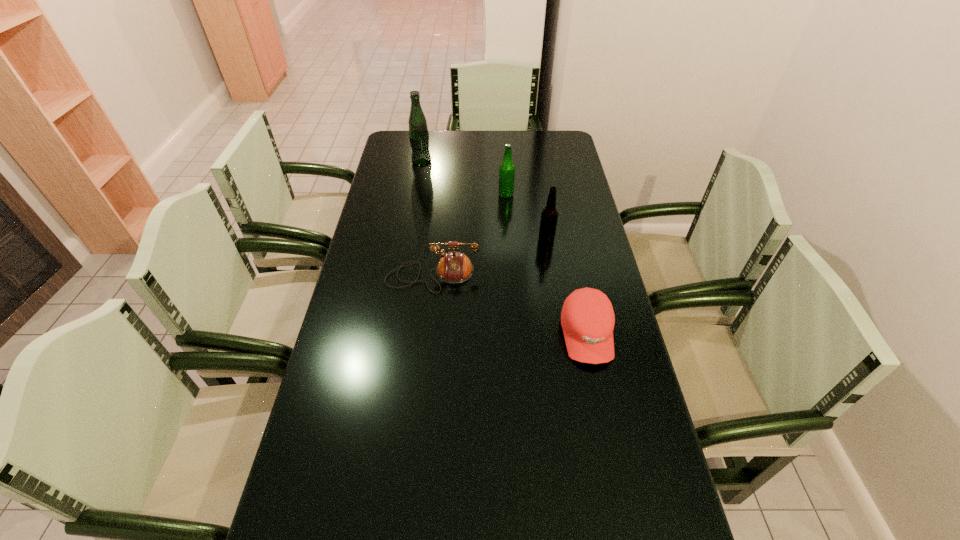
Where is `the tallest beer bottle`? the tallest beer bottle is located at coordinates (418, 131).

Identify the location of the farthest object. This screenshot has height=540, width=960. (418, 131).

Locate an element on the screen. The image size is (960, 540). the rightmost beer bottle is located at coordinates (549, 215).

Find the location of a particular element. This screenshot has height=540, width=960. the nearest beer bottle is located at coordinates (549, 215).

Locate an element on the screen. This screenshot has width=960, height=540. the third object from right to left is located at coordinates (507, 169).

Locate an element on the screen. the fourth nearest object is located at coordinates [x=507, y=169].

Find the location of a particular element. The image size is (960, 540). telephone is located at coordinates (454, 267).

Identify the location of the nearest object. This screenshot has height=540, width=960. (587, 317).

Identify the location of free location located on the right of the leftmost beer bottle. (456, 163).

Find the location of `free space located on the back of the nearest beer bottle`. free space located on the back of the nearest beer bottle is located at coordinates (540, 202).